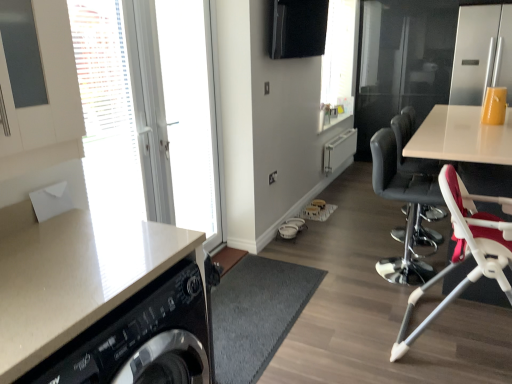
Image resolution: width=512 pixels, height=384 pixels. I want to click on vacant space behind black leather chair at right, which appears as the 2th chair when viewed from the front, so click(x=367, y=242).